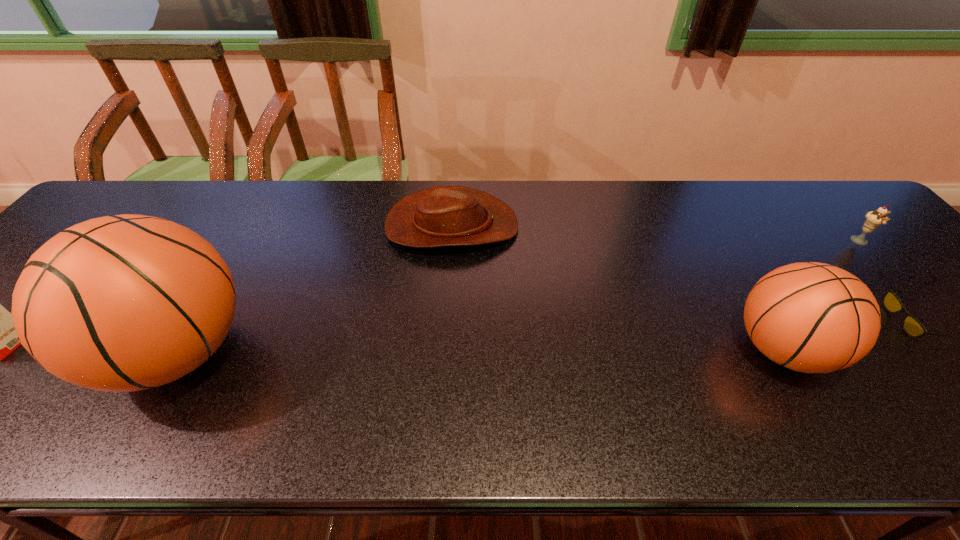
The height and width of the screenshot is (540, 960). In the image, there is a desktop. Identify the location of vacant space at the right edge. (896, 273).

Find the location of a particular element. The image size is (960, 540). empty location between the fifth tallest object and the shortest object is located at coordinates (682, 274).

At what (x,y) coordinates should I click in order to perform the action: click on vacant region between the fourth tallest object and the cowboy hat. Please return your answer as a coordinate pair (x, y). Looking at the image, I should click on (657, 234).

At what (x,y) coordinates should I click in order to perform the action: click on vacant area that lies between the icecream and the cowboy hat. Please return your answer as a coordinate pair (x, y). The height and width of the screenshot is (540, 960). Looking at the image, I should click on click(657, 234).

What are the coordinates of `vacant area that lies between the third object from left to right and the sunglasses` in the screenshot? It's located at (682, 274).

Find the location of `object that is the second closest to the right basketball`. object that is the second closest to the right basketball is located at coordinates click(x=873, y=220).

You are a GUI agent. You are given a task and a screenshot of the screen. Output one action in this format:
    pyautogui.click(x=<x>, y=<y>)
    Task: Click on the object that is the fourth closest one to the shortest object
    The width and height of the screenshot is (960, 540).
    Given the screenshot: What is the action you would take?
    pyautogui.click(x=124, y=303)

You are a GUI agent. You are given a task and a screenshot of the screen. Output one action in this format:
    pyautogui.click(x=<x>, y=<y>)
    Task: Click on the vacant space that satisfies the following two spatial constraints: 1. on the front-facing side of the fourth tallest object; 2. on the right side of the fourth object from right to left
    
    Given the screenshot: What is the action you would take?
    pyautogui.click(x=451, y=242)

Image resolution: width=960 pixels, height=540 pixels. What are the coordinates of `free region that satisfies the following two spatial constraints: 1. on the front-facing side of the second shortest object; 2. on the left side of the right basketball` in the screenshot? It's located at (444, 349).

At what (x,y) coordinates should I click in order to perform the action: click on vacant space that satisfies the following two spatial constraints: 1. on the front-facing side of the fourth object from right to left; 2. on the right side of the right basketball. Please return your answer as a coordinate pair (x, y). The image size is (960, 540). Looking at the image, I should click on [444, 349].